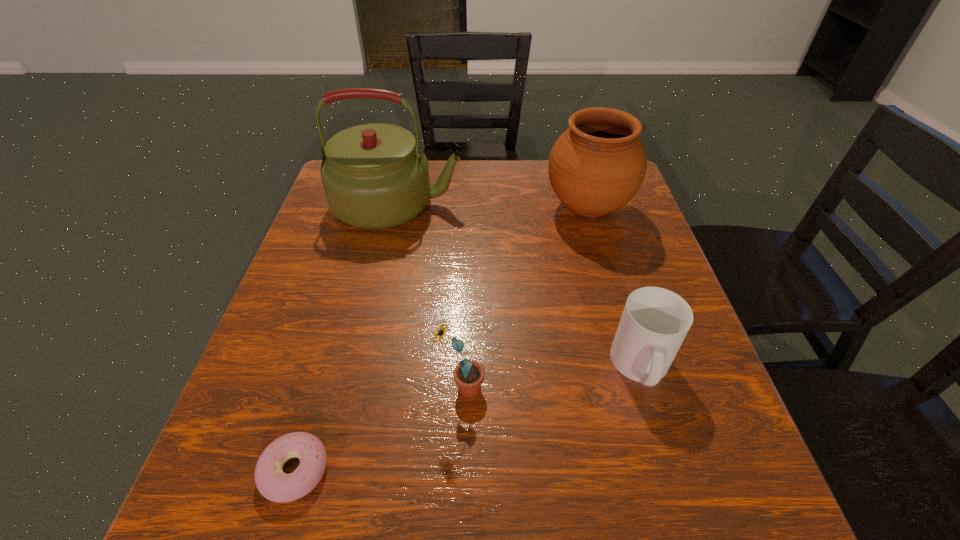
Image resolution: width=960 pixels, height=540 pixels. What are the coordinates of `kettle` in the screenshot? It's located at (374, 176).

This screenshot has height=540, width=960. In order to click on the fourth shortest object in this screenshot , I will do `click(598, 164)`.

I want to click on sunflower, so [468, 374].

The image size is (960, 540). In order to click on mug in this screenshot , I will do `click(655, 321)`.

Find the location of a particular element. The width and height of the screenshot is (960, 540). the nearest object is located at coordinates (275, 485).

In order to click on doughnut in this screenshot , I will do (275, 485).

Where is `vacant space situated 0.290m at the spout of the kettle`? The width and height of the screenshot is (960, 540). vacant space situated 0.290m at the spout of the kettle is located at coordinates (569, 204).

Locate an element on the screen. The image size is (960, 540). vacant area situated 0.060m on the front of the pottery is located at coordinates (601, 252).

The width and height of the screenshot is (960, 540). I want to click on vacant area located 0.400m on the flower of the sunflower, so click(708, 388).

The height and width of the screenshot is (540, 960). Find the location of `vacant region located 0.050m on the handle side of the second shortest object`. vacant region located 0.050m on the handle side of the second shortest object is located at coordinates (660, 429).